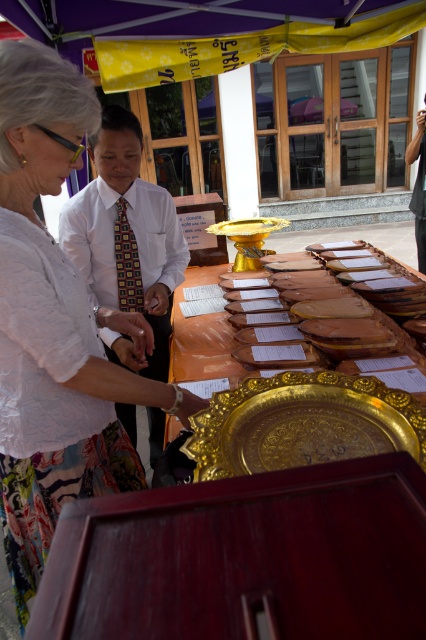
Consider the image. You are a photographer standing at the back of the canopy. You need to capture a photo that includes both the white lace blouse at upper left and the white shirt with tie at center. The camera you are using has a maximum focus range of 60 centimeters. Will you be able to fit both subjects within the camera focus range?

The white lace blouse at upper left and white shirt with tie at center are 63.61 centimeters apart from each other. Since the distance between them exceeds the camera focus range of 60 centimeters, you will not be able to fit both subjects within the camera focus range.

You are a photographer positioned at the back of the scene. You need to capture a clear photo of both the white shirt with tie at center and the gold metallic tray at center. Based on their positions, which object should you focus on first to ensure both are in frame?

The white shirt with tie at center is to the left of the gold metallic tray at center. Since you are positioned at the back, focusing on the leftmost object first ensures both are in frame.